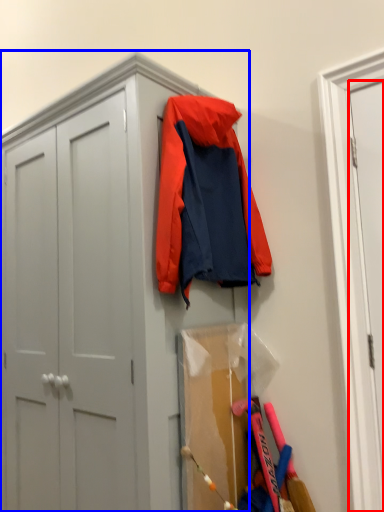
Question: Which object is further to the camera taking this photo, door (highlighted by a red box) or cabinetry (highlighted by a blue box)?

Choices:
 (A) door
 (B) cabinetry

Answer: (A)